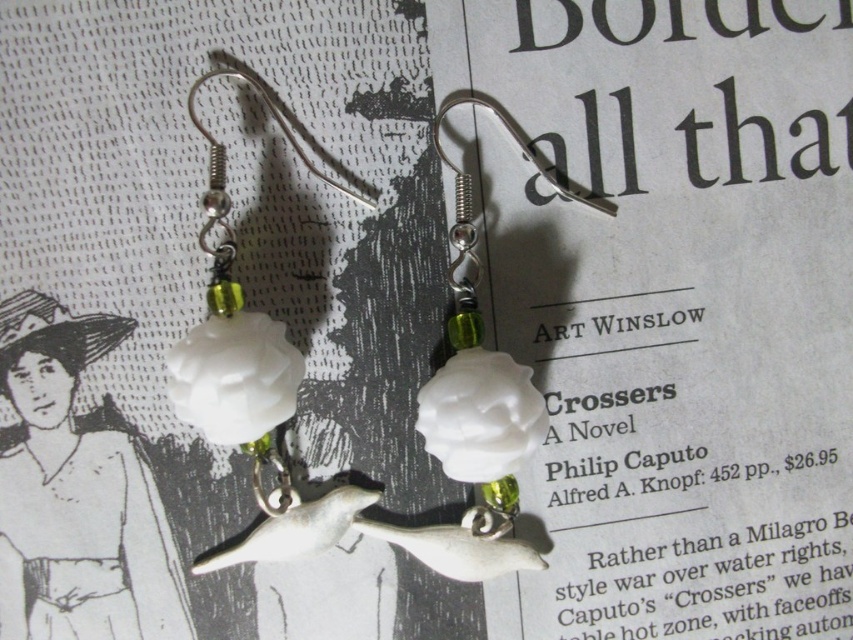
Is matte white porcelain at center positioned at the back of white porcelain flower at center?

Yes.

Who is more forward, (77, 442) or (210, 326)?

Point (210, 326) is in front.

This screenshot has width=853, height=640. What are the coordinates of `matte white porcelain at center` in the screenshot? It's located at (76, 496).

Can you confirm if matte white porcelain at center is bigger than white porcelain rose at center?

No, matte white porcelain at center is not bigger than white porcelain rose at center.

Is matte white porcelain at center closer to the viewer compared to white porcelain rose at center?

No, matte white porcelain at center is further to the viewer.

Does point (184, 637) come farther from viewer compared to point (456, 218)?

No, (184, 637) is in front of (456, 218).

Where is `matte white porcelain at center`? matte white porcelain at center is located at coordinates (76, 496).

Which is more to the left, white porcelain flower at center or white porcelain rose at center?

white porcelain flower at center

Does point (216, 371) lie in front of point (457, 285)?

Yes, it is.

Locate an element on the screen. Image resolution: width=853 pixels, height=640 pixels. white porcelain flower at center is located at coordinates (251, 381).